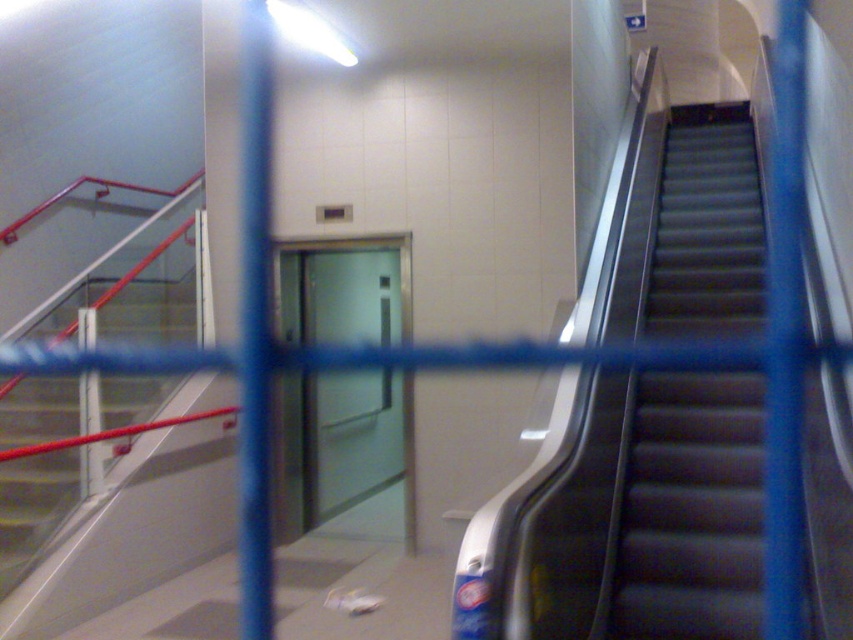
You are standing at the entrance of the public transportation hub and want to take the transparent glass elevator at center to the upper floor. The escalator on the right is moving upwards. To reach the elevator, should you walk towards the escalator or away from it?

Since the transparent glass elevator at center is located at point (x=338, y=442), which is to the right side of the scene, you should walk towards the escalator on the right to reach the transparent glass elevator at center.

You are standing at the bottom of the escalator and want to reach the point marked by point (741, 474). There is an obstacle at point (305, 308). Can you safely walk around the obstacle to reach your destination?

Yes, you can safely walk around the obstacle because point (741, 474) is in front of point (305, 308), meaning the destination is closer to you than the obstacle.

You are standing in the transportation hub and want to know which of the two points, point (x=328, y=266) or point (x=28, y=397), is closer to you. Can you determine this based on their positions?

Point (x=328, y=266) is closer to you because it is further to the viewer than point (x=28, y=397).